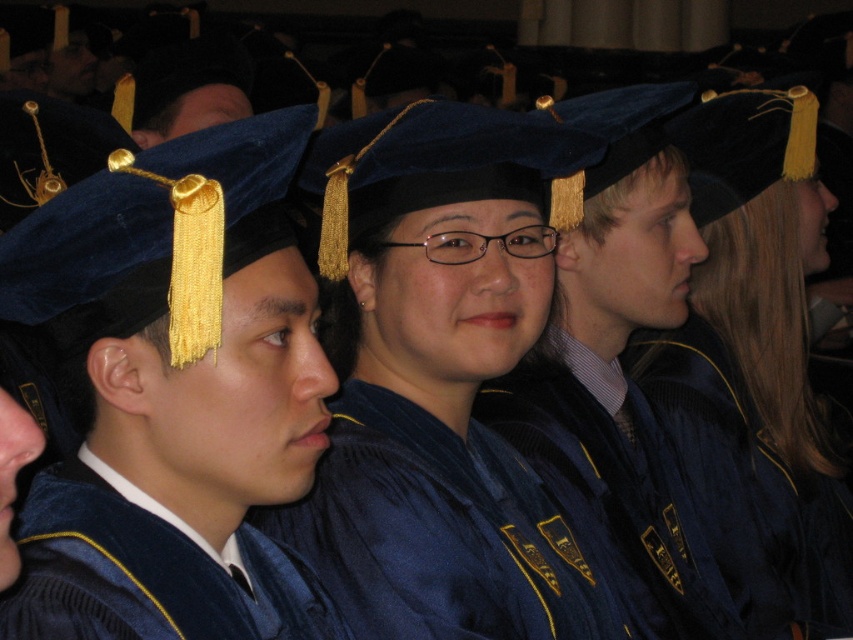
You are attending a graduation ceremony and want to locate the velvet blue graduation cap at center. According to the coordinate system where the bottom left corner is the origin, can you confirm if the point with coordinates (175,394) falls on the velvet blue graduation cap at center?

Yes, the point (175,394) is on the velvet blue graduation cap at center as stated in the description.

You are a photographer at the graduation ceremony. You want to take a photo of the velvet blue gown at center and the velvet blue graduation cap at center. Can you adjust your position so that both are fully visible without any overlap?

The velvet blue gown at center is behind the velvet blue graduation cap at center, so adjusting your position might allow you to capture both without overlap by angling the camera to show the gown behind the cap or moving to the side to see both clearly.